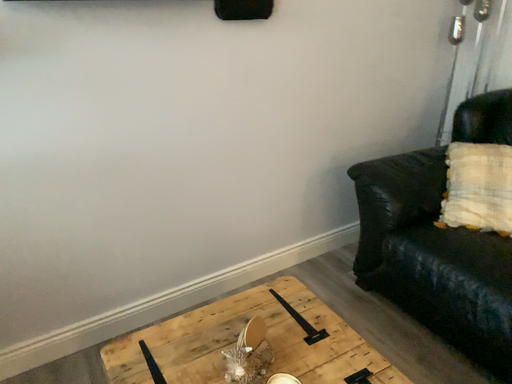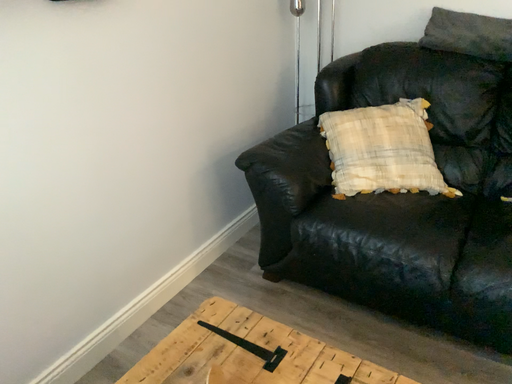
Question: How did the camera likely rotate when shooting the video?

Choices:
 (A) rotated left
 (B) rotated right

Answer: (B)